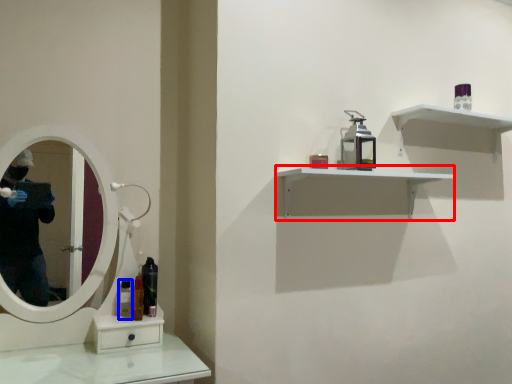
Question: Which object is closer to the camera taking this photo, shelf (highlighted by a red box) or mouthwash (highlighted by a blue box)?

Choices:
 (A) shelf
 (B) mouthwash

Answer: (A)